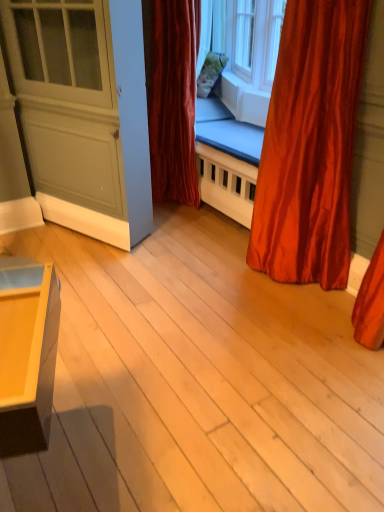
Locate an element on the screen. free area in between satin red curtain at right, the second curtain viewed from the back, and matte gray screen door at left is located at coordinates (198, 258).